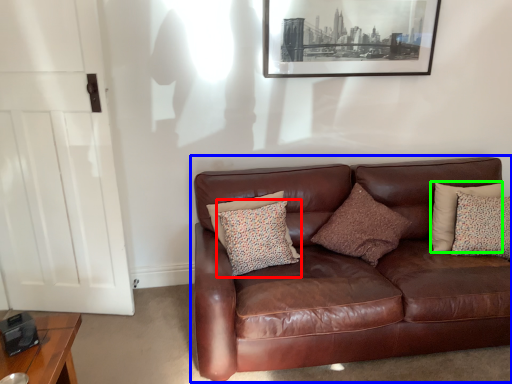
Question: Based on their relative distances, which object is nearer to pillow (highlighted by a red box)? Choose from studio couch (highlighted by a blue box) and pillow (highlighted by a green box).

Choices:
 (A) studio couch
 (B) pillow

Answer: (A)